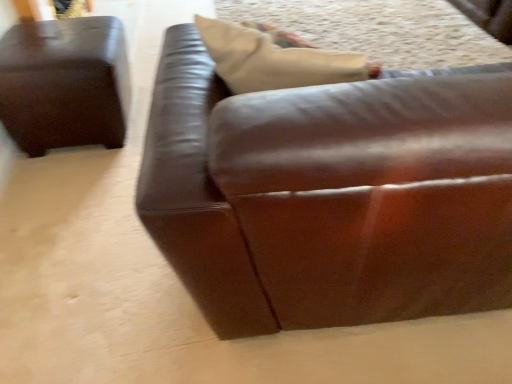
You are a GUI agent. You are given a task and a screenshot of the screen. Output one action in this format:
    pyautogui.click(x=<x>, y=<y>)
    Task: Click on the brown leather couch at center, which is the 2th studio couch in left-to-right order
    This screenshot has width=512, height=384.
    Given the screenshot: What is the action you would take?
    pyautogui.click(x=328, y=196)

Describe the element at coordinates (328, 196) in the screenshot. I see `brown leather couch at center, the 1th studio couch when ordered from right to left` at that location.

This screenshot has height=384, width=512. What do you see at coordinates (65, 84) in the screenshot? I see `brown leather ottoman at left, which appears as the 2th studio couch when viewed from the right` at bounding box center [65, 84].

Where is `brown leather ottoman at left, which appears as the 2th studio couch when viewed from the right`? The image size is (512, 384). brown leather ottoman at left, which appears as the 2th studio couch when viewed from the right is located at coordinates (65, 84).

Find the location of a particular element. The width and height of the screenshot is (512, 384). brown leather couch at center, which is the 2th studio couch in left-to-right order is located at coordinates 328,196.

In the image, is brown leather ottoman at left, which appears as the 2th studio couch when viewed from the right, on the left side or the right side of brown leather couch at center, which is the 2th studio couch in left-to-right order?

From the image, it's evident that brown leather ottoman at left, which appears as the 2th studio couch when viewed from the right, is to the left of brown leather couch at center, which is the 2th studio couch in left-to-right order.

In the image, is brown leather ottoman at left, marked as the first studio couch in a left-to-right arrangement, positioned in front of or behind brown leather couch at center, the 1th studio couch when ordered from right to left?

In the image, brown leather ottoman at left, marked as the first studio couch in a left-to-right arrangement, appears behind brown leather couch at center, the 1th studio couch when ordered from right to left.

Considering the points (108, 78) and (215, 302), which point is behind, point (108, 78) or point (215, 302)?

The point (108, 78) is farther.

From the image's perspective, is brown leather ottoman at left, which appears as the 2th studio couch when viewed from the right, above or below brown leather couch at center, which is the 2th studio couch in left-to-right order?

Clearly, from the image's perspective, brown leather ottoman at left, which appears as the 2th studio couch when viewed from the right, is above brown leather couch at center, which is the 2th studio couch in left-to-right order.

From a real-world perspective, is brown leather ottoman at left, marked as the first studio couch in a left-to-right arrangement, physically located above or below brown leather couch at center, which is the 2th studio couch in left-to-right order?

brown leather ottoman at left, marked as the first studio couch in a left-to-right arrangement, is below brown leather couch at center, which is the 2th studio couch in left-to-right order.

Considering the sizes of brown leather ottoman at left, which appears as the 2th studio couch when viewed from the right, and brown leather couch at center, which is the 2th studio couch in left-to-right order, in the image, is brown leather ottoman at left, which appears as the 2th studio couch when viewed from the right, wider or thinner than brown leather couch at center, which is the 2th studio couch in left-to-right order,?

In the image, brown leather ottoman at left, which appears as the 2th studio couch when viewed from the right, appears to be more narrow than brown leather couch at center, which is the 2th studio couch in left-to-right order.

Which of these two, brown leather ottoman at left, which appears as the 2th studio couch when viewed from the right, or brown leather couch at center, which is the 2th studio couch in left-to-right order, stands taller?

brown leather couch at center, which is the 2th studio couch in left-to-right order.

Based on their sizes in the image, would you say brown leather ottoman at left, marked as the first studio couch in a left-to-right arrangement, is bigger or smaller than brown leather couch at center, the 1th studio couch when ordered from right to left?

Clearly, brown leather ottoman at left, marked as the first studio couch in a left-to-right arrangement, is smaller in size than brown leather couch at center, the 1th studio couch when ordered from right to left.

Is brown leather couch at center, which is the 2th studio couch in left-to-right order, a part of brown leather ottoman at left, marked as the first studio couch in a left-to-right arrangement?

Actually, brown leather couch at center, which is the 2th studio couch in left-to-right order, is outside brown leather ottoman at left, marked as the first studio couch in a left-to-right arrangement.

Would you consider brown leather ottoman at left, marked as the first studio couch in a left-to-right arrangement, to be distant from brown leather couch at center, which is the 2th studio couch in left-to-right order?

brown leather ottoman at left, marked as the first studio couch in a left-to-right arrangement, is positioned a significant distance from brown leather couch at center, which is the 2th studio couch in left-to-right order.

Is brown leather ottoman at left, which appears as the 2th studio couch when viewed from the right, facing away from brown leather couch at center, the 1th studio couch when ordered from right to left?

No, brown leather ottoman at left, which appears as the 2th studio couch when viewed from the right,'s orientation is not away from brown leather couch at center, the 1th studio couch when ordered from right to left.

What's the angular difference between brown leather ottoman at left, which appears as the 2th studio couch when viewed from the right, and brown leather couch at center, the 1th studio couch when ordered from right to left,'s facing directions?

86.6 degrees.

This screenshot has width=512, height=384. What are the coordinates of `studio couch in front of the brown leather ottoman at left, marked as the first studio couch in a left-to-right arrangement` in the screenshot? It's located at (328, 196).

Consider the image. Is brown leather couch at center, the 1th studio couch when ordered from right to left, at the right side of brown leather ottoman at left, which appears as the 2th studio couch when viewed from the right?

Correct, you'll find brown leather couch at center, the 1th studio couch when ordered from right to left, to the right of brown leather ottoman at left, which appears as the 2th studio couch when viewed from the right.

Does brown leather couch at center, which is the 2th studio couch in left-to-right order, come in front of brown leather ottoman at left, which appears as the 2th studio couch when viewed from the right?

Yes, the depth of brown leather couch at center, which is the 2th studio couch in left-to-right order, is less than that of brown leather ottoman at left, which appears as the 2th studio couch when viewed from the right.

Which point is more distant from viewer, (222, 174) or (10, 122)?

The point (10, 122) is more distant.

From the image's perspective, who appears lower, brown leather couch at center, the 1th studio couch when ordered from right to left, or brown leather ottoman at left, which appears as the 2th studio couch when viewed from the right?

brown leather couch at center, the 1th studio couch when ordered from right to left, from the image's perspective.

From the picture: From a real-world perspective, relative to brown leather ottoman at left, which appears as the 2th studio couch when viewed from the right, is brown leather couch at center, which is the 2th studio couch in left-to-right order, vertically above or below?

In terms of real-world spatial position, brown leather couch at center, which is the 2th studio couch in left-to-right order, is above brown leather ottoman at left, which appears as the 2th studio couch when viewed from the right.

Considering the sizes of objects brown leather couch at center, the 1th studio couch when ordered from right to left, and brown leather ottoman at left, which appears as the 2th studio couch when viewed from the right, in the image provided, who is wider, brown leather couch at center, the 1th studio couch when ordered from right to left, or brown leather ottoman at left, which appears as the 2th studio couch when viewed from the right,?

With larger width is brown leather couch at center, the 1th studio couch when ordered from right to left.

In terms of height, does brown leather couch at center, the 1th studio couch when ordered from right to left, look taller or shorter compared to brown leather ottoman at left, marked as the first studio couch in a left-to-right arrangement?

Clearly, brown leather couch at center, the 1th studio couch when ordered from right to left, is taller compared to brown leather ottoman at left, marked as the first studio couch in a left-to-right arrangement.

From the picture: Between brown leather couch at center, which is the 2th studio couch in left-to-right order, and brown leather ottoman at left, which appears as the 2th studio couch when viewed from the right, which one has larger size?

Bigger between the two is brown leather couch at center, which is the 2th studio couch in left-to-right order.

Would you say brown leather couch at center, which is the 2th studio couch in left-to-right order, is outside brown leather ottoman at left, marked as the first studio couch in a left-to-right arrangement?

Yes, brown leather couch at center, which is the 2th studio couch in left-to-right order, is outside of brown leather ottoman at left, marked as the first studio couch in a left-to-right arrangement.

Is brown leather couch at center, the 1th studio couch when ordered from right to left, not close to brown leather ottoman at left, which appears as the 2th studio couch when viewed from the right?

Yes.

Is brown leather couch at center, the 1th studio couch when ordered from right to left, oriented away from brown leather ottoman at left, which appears as the 2th studio couch when viewed from the right?

No, brown leather ottoman at left, which appears as the 2th studio couch when viewed from the right, is not at the back of brown leather couch at center, the 1th studio couch when ordered from right to left.

In the image, there is a brown leather couch at center, the 1th studio couch when ordered from right to left. Identify the location of studio couch below it (from a real-world perspective). click(65, 84).

I want to click on studio couch above the brown leather ottoman at left, marked as the first studio couch in a left-to-right arrangement (from a real-world perspective), so click(x=328, y=196).

Where is `studio couch in front of the brown leather ottoman at left, which appears as the 2th studio couch when viewed from the right`? studio couch in front of the brown leather ottoman at left, which appears as the 2th studio couch when viewed from the right is located at coordinates (328, 196).